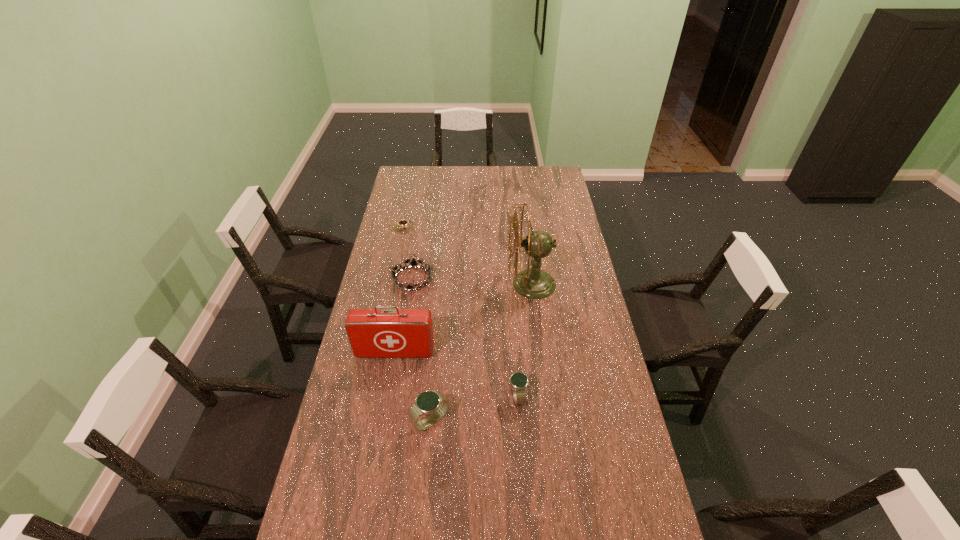
This screenshot has width=960, height=540. In order to click on free space that satisfies the following two spatial constraints: 1. on the front-facing side of the fifth tallest object; 2. on the left side of the fourth tallest object in this screenshot , I will do `click(394, 396)`.

Find the location of a particular element. The width and height of the screenshot is (960, 540). vacant space that satisfies the following two spatial constraints: 1. in front of the tallest object, directing air flow; 2. on the side of the fifth shortest object with the first aid cross symbol is located at coordinates (540, 352).

Where is `free location that satisfies the following two spatial constraints: 1. in front of the fan, directing air flow; 2. on the side of the second tallest object with the first aid cross symbol`? free location that satisfies the following two spatial constraints: 1. in front of the fan, directing air flow; 2. on the side of the second tallest object with the first aid cross symbol is located at coordinates (540, 352).